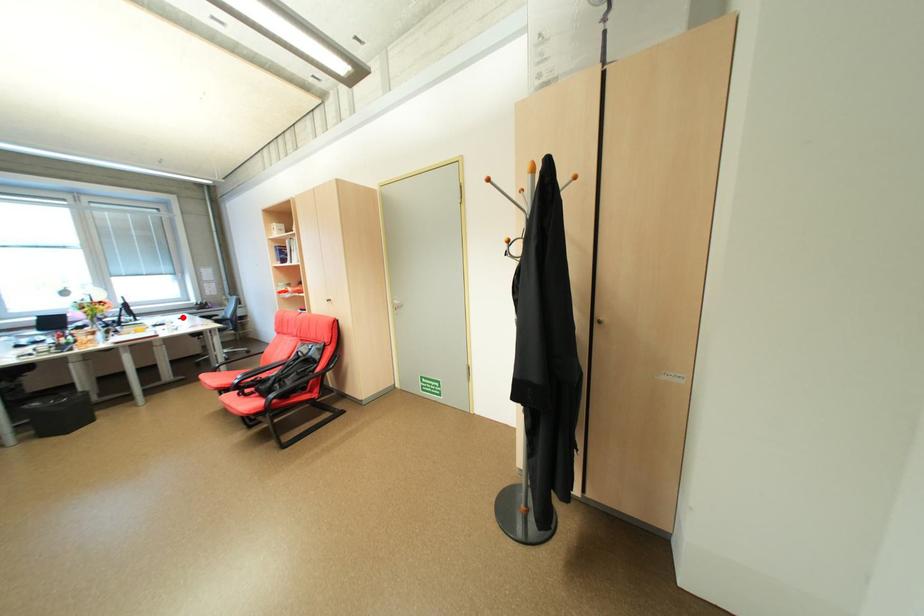
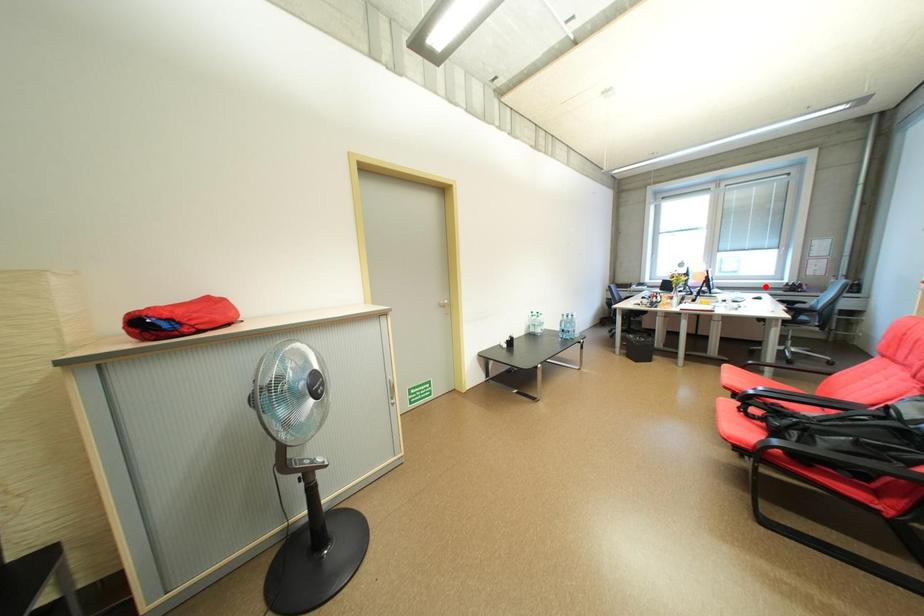
Consider the image. I am providing you with two images of the same scene from different viewpoints. A red point is marked on the first image and another point is marked on the second image. Are the points marked in image1 and image2 representing the same 3D position?

No